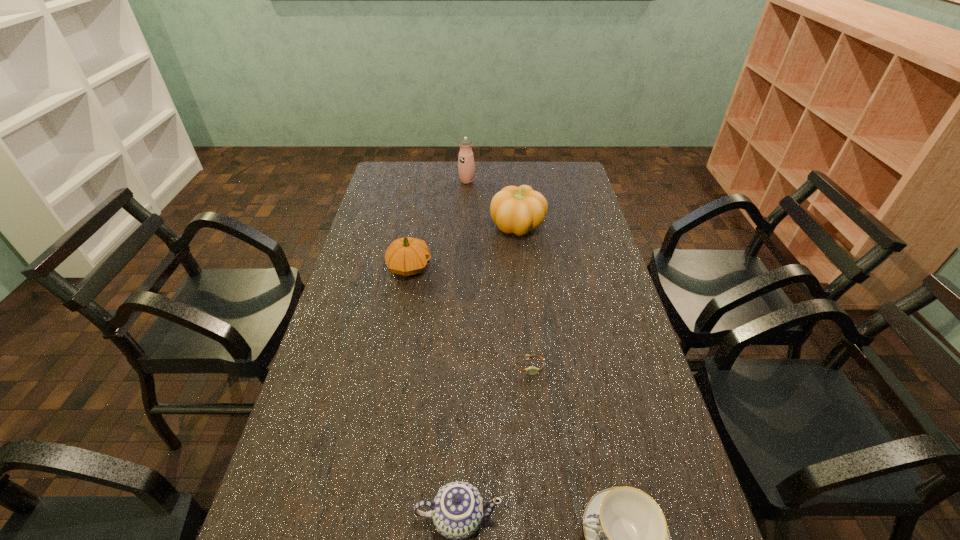
Find the location of a particular element. The width and height of the screenshot is (960, 540). vacant region located 0.210m on the side of the gourd with the carved face is located at coordinates (493, 267).

Locate an element on the screen. This screenshot has height=540, width=960. blank space located 0.050m on the face of the fourth farthest object is located at coordinates pos(531,392).

Identify the location of object that is positioned at the far edge. Image resolution: width=960 pixels, height=540 pixels. (466, 166).

Locate an element on the screen. Image resolution: width=960 pixels, height=540 pixels. object located in the left edge section of the desktop is located at coordinates (406, 256).

Locate an element on the screen. vacant space at the far edge of the desktop is located at coordinates [x=492, y=161].

At what (x,y) coordinates should I click in order to perform the action: click on vacant space at the left edge of the desktop. Please return your answer as a coordinate pair (x, y). The image size is (960, 540). Looking at the image, I should click on (393, 192).

Where is `vacant region at the right edge`? vacant region at the right edge is located at coordinates (579, 252).

You are a GUI agent. You are given a task and a screenshot of the screen. Output one action in this format:
    pyautogui.click(x=<x>, y=<y>)
    Task: Click on the free region at the far left corner of the desktop
    
    Given the screenshot: What is the action you would take?
    pyautogui.click(x=388, y=166)

I want to click on free space between the fourth farthest object and the tallest object, so click(x=498, y=274).

The height and width of the screenshot is (540, 960). In order to click on vacant space that's between the thermos bottle and the third nearest object in this screenshot , I will do `click(498, 274)`.